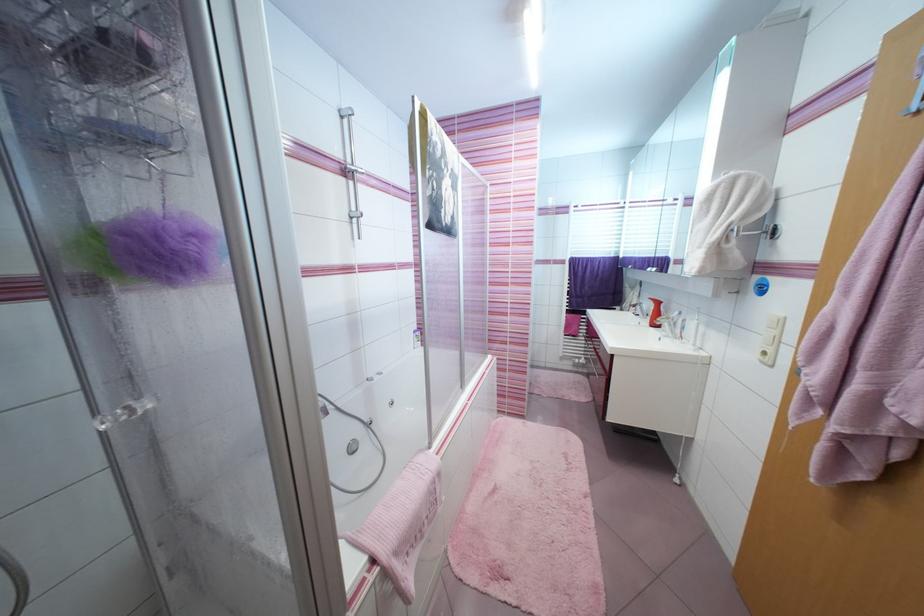
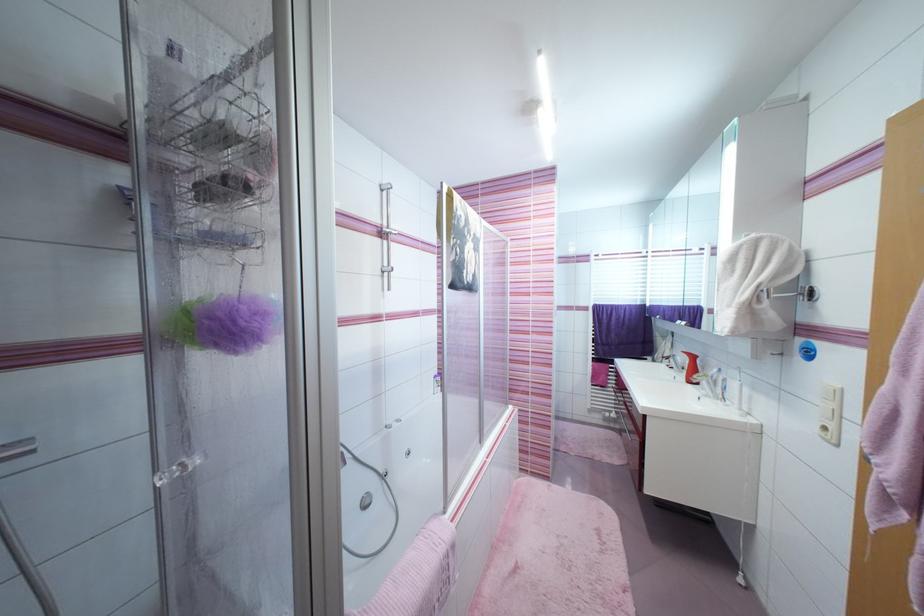
The point at (672, 338) is marked in the first image. Where is the corresponding point in the second image?

(711, 398)